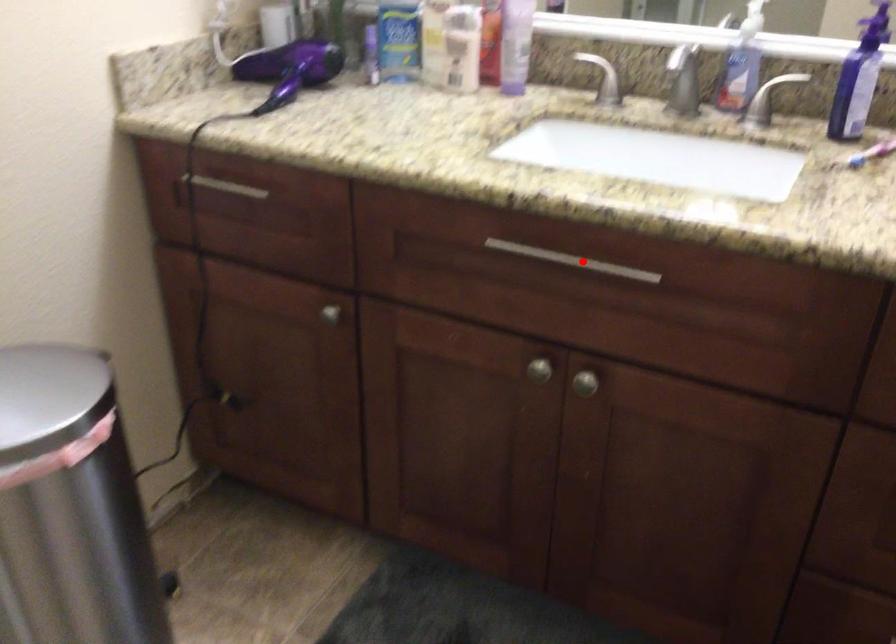
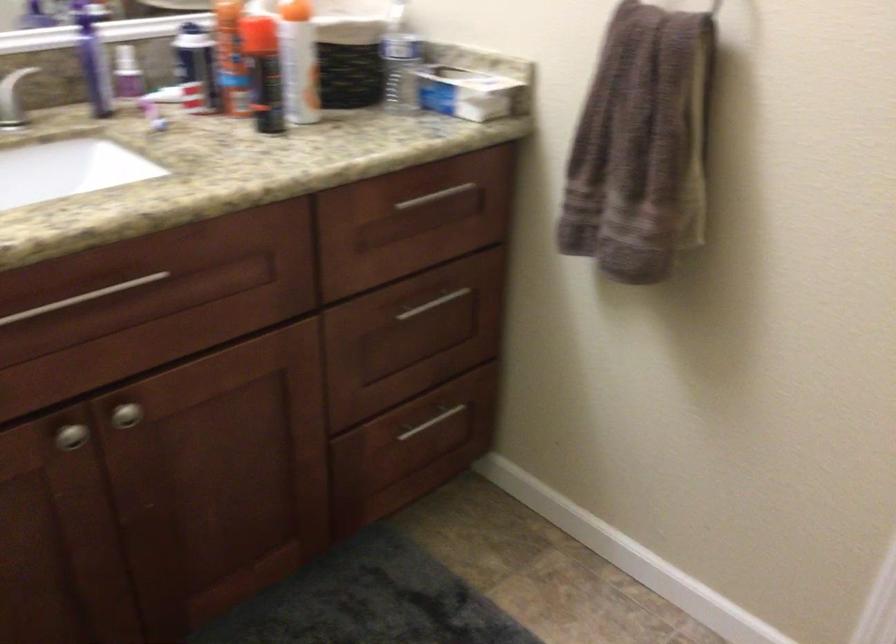
In the second image, find the point that corresponds to the highlighted location in the first image.

(82, 298)